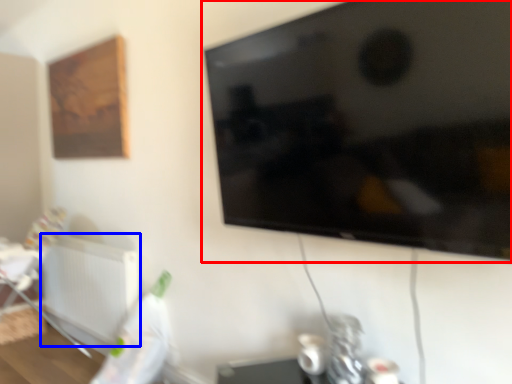
Question: Which of the following is the closest to the observer, television (highlighted by a red box) or radiator (highlighted by a blue box)?

Choices:
 (A) television
 (B) radiator

Answer: (A)